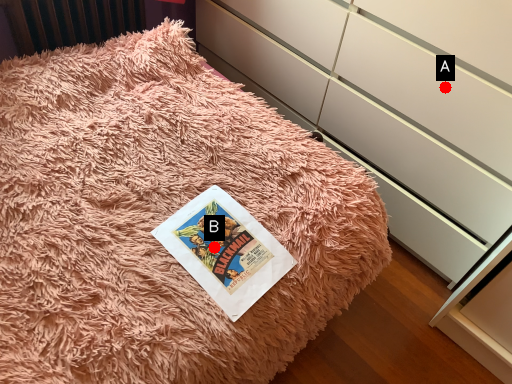
Question: Two points are circled on the image, labeled by A and B beside each circle. Which point appears closest to the camera in this image?

Choices:
 (A) A is closer
 (B) B is closer

Answer: (B)